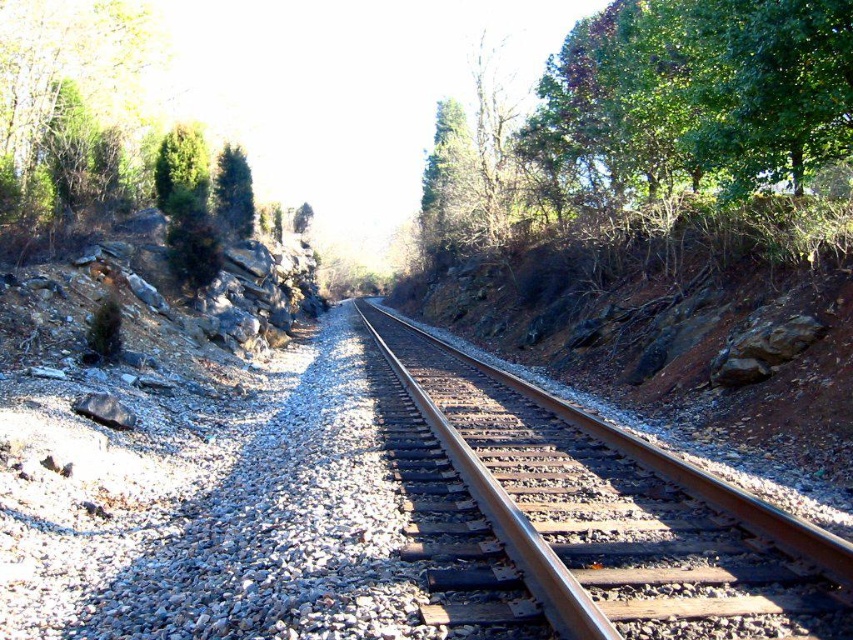
You are a hiker standing at the center of the railway track. You see a green leafy tree at upper right and a green matte tree at upper left. Which tree is closer to you?

The green leafy tree at upper right is closer to you because it is in front of the green matte tree at upper left.

You are standing at the center of the metal train track at center and want to walk towards the green matte tree at upper left. Which direction should you face to walk towards it?

You should face to the left because the metal train track at center is to the right of the green matte tree at upper left, so walking left will lead you towards it.

You are a bird looking for a nesting spot. You see the green leafy tree at upper right and the green matte tree at upper left. Which tree is taller and better for nesting?

The green leafy tree at upper right is taller than the green matte tree at upper left, so it would be better for nesting.